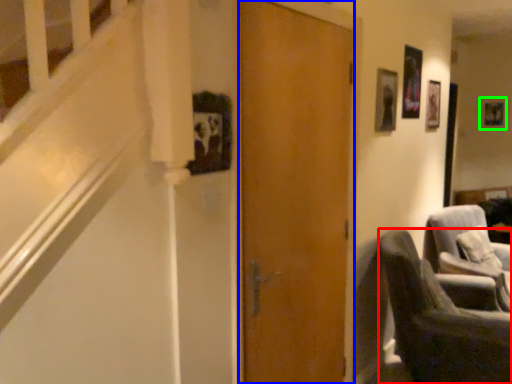
Question: Based on their relative distances, which object is farther from chair (highlighted by a red box)? Choose from door (highlighted by a blue box) and picture frame (highlighted by a green box).

Choices:
 (A) door
 (B) picture frame

Answer: (B)